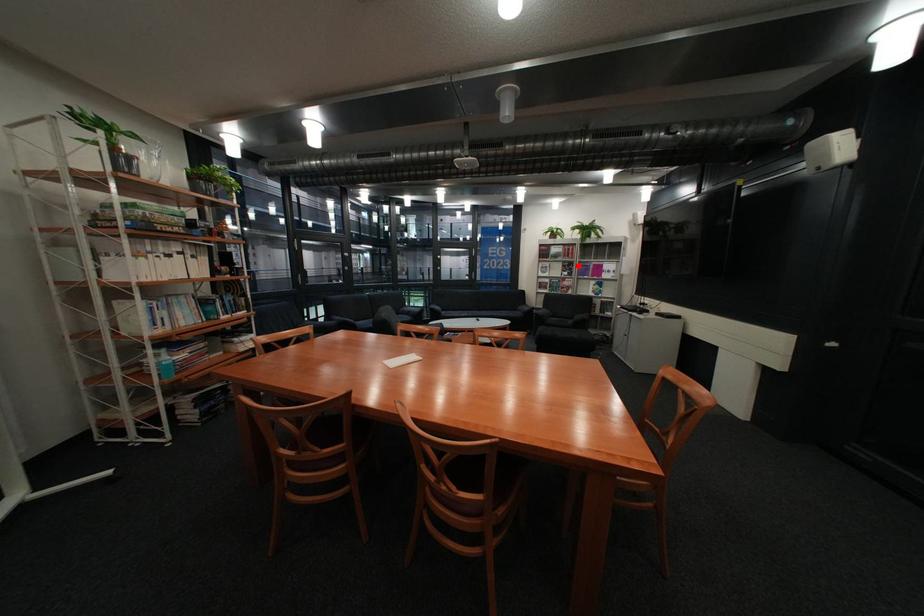
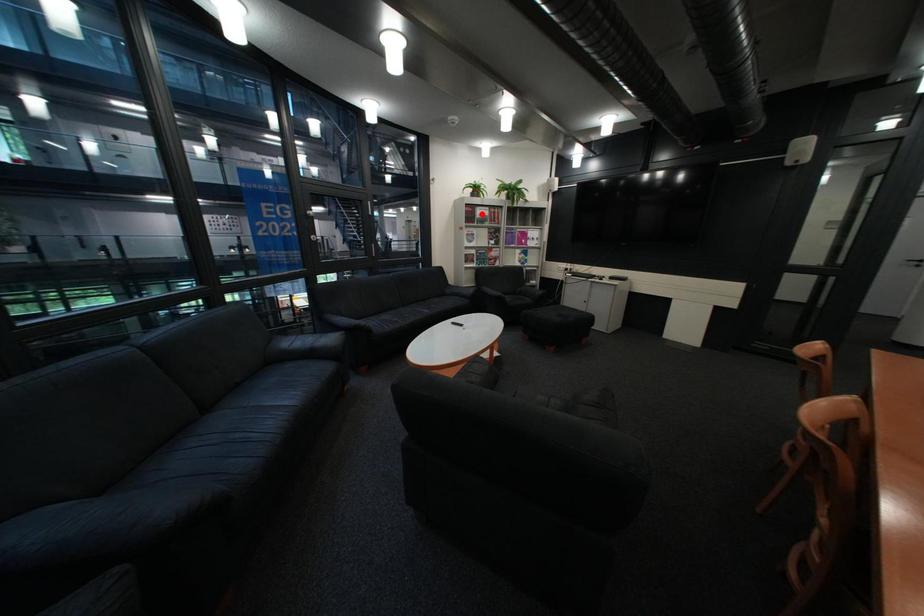
I am providing you with two images of the same scene from different viewpoints. A red point is marked on the first image and another point is marked on the second image. Are the points marked in image1 and image2 representing the same 3D position?

No